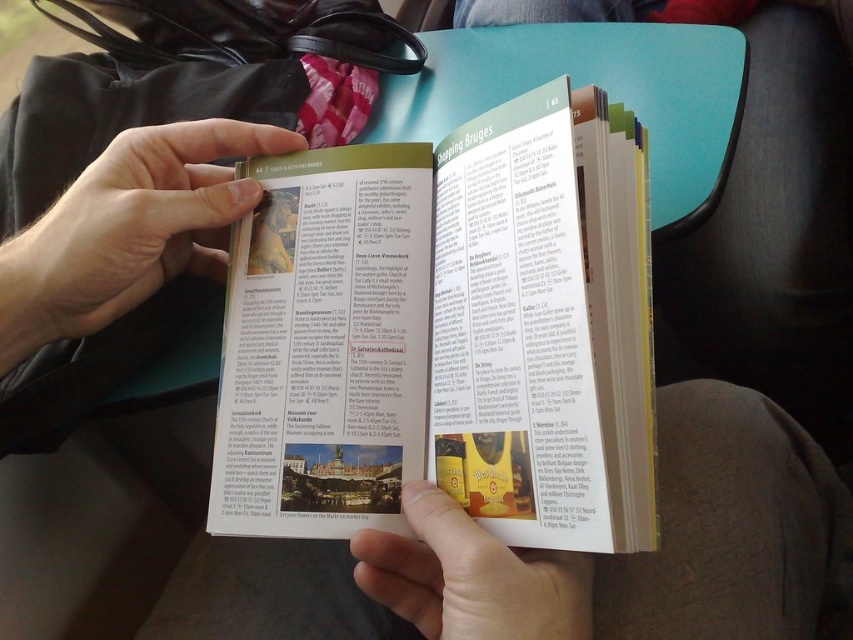
You are a delivery robot with a width of 40 centimeters. You need to pass between the two points marked at point (212, 221). Can you fit through the space between them?

The two points are 44.52 centimeters apart, so the delivery robot with a width of 40 centimeters can fit through the space between them since it is wider than the robot.

You are a traveler who needs to place a 4.5 inch wide souvenir on the table between the paperback book at center and the matte yellow paper at lower center. Can the souvenir fit in that space?

The space between the paperback book at center and the matte yellow paper at lower center is only 3.94 inches wide, which is narrower than the 4.5 inch wide souvenir. Therefore, the souvenir cannot fit in that space.

You are a person trying to read the text on the matte yellow paper at lower center. Can you read it without moving the smooth skin hand at center that is currently above it?

The smooth skin hand at center is above the matte yellow paper at lower center, so it is blocking the view. You need to move the hand to read the text.